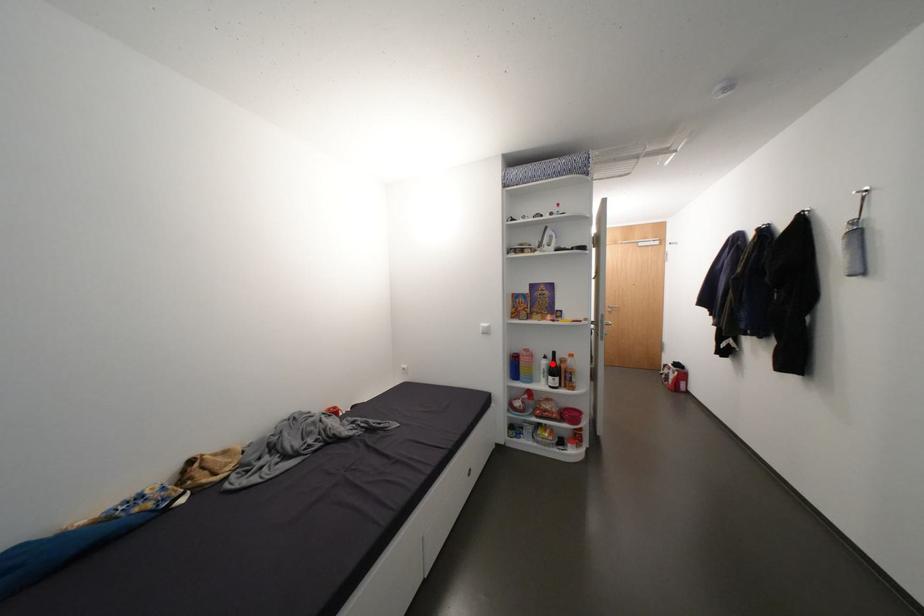
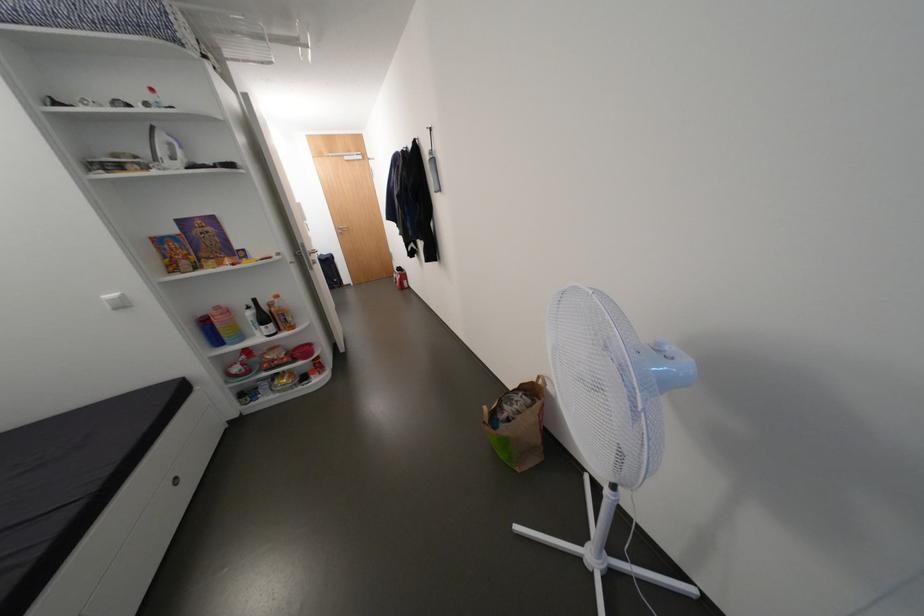
Locate, in the second image, the point that corresponds to the highlighted location in the first image.

(258, 315)